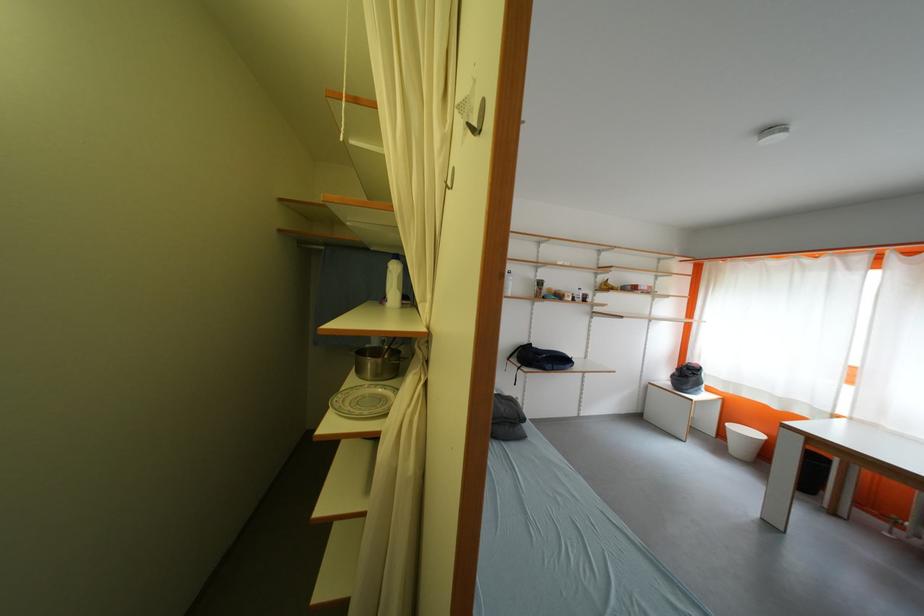
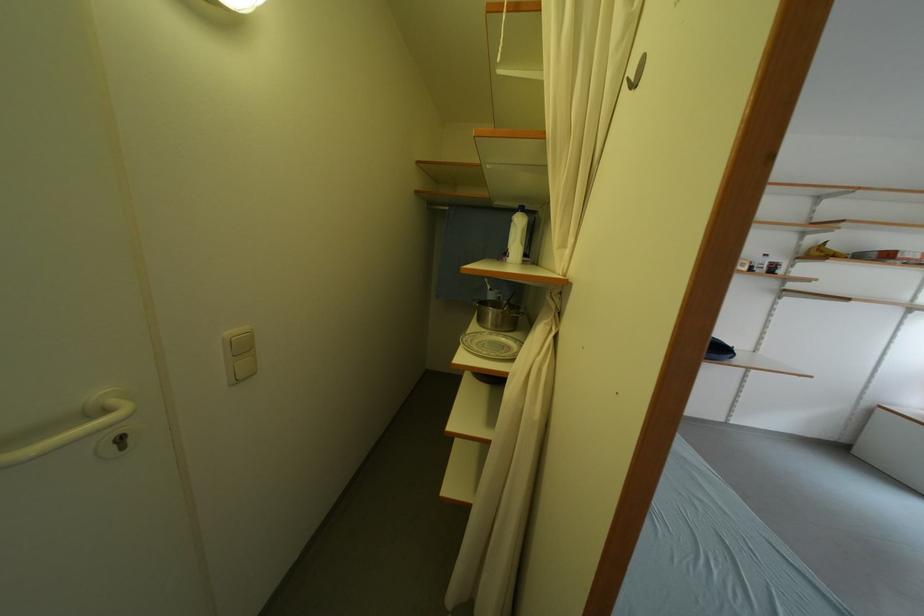
Find the pixel in the second image that matches (x=395, y=270) in the first image.

(518, 225)